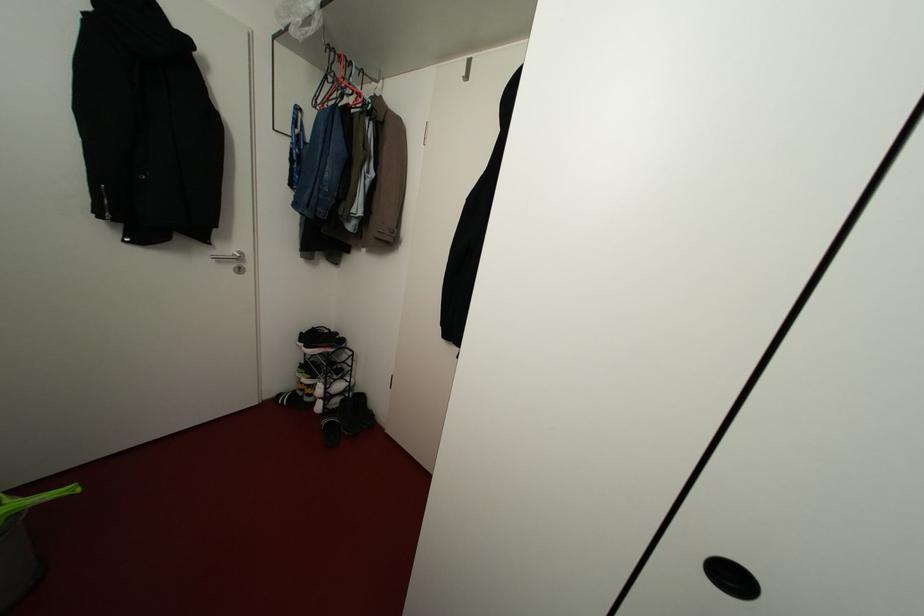
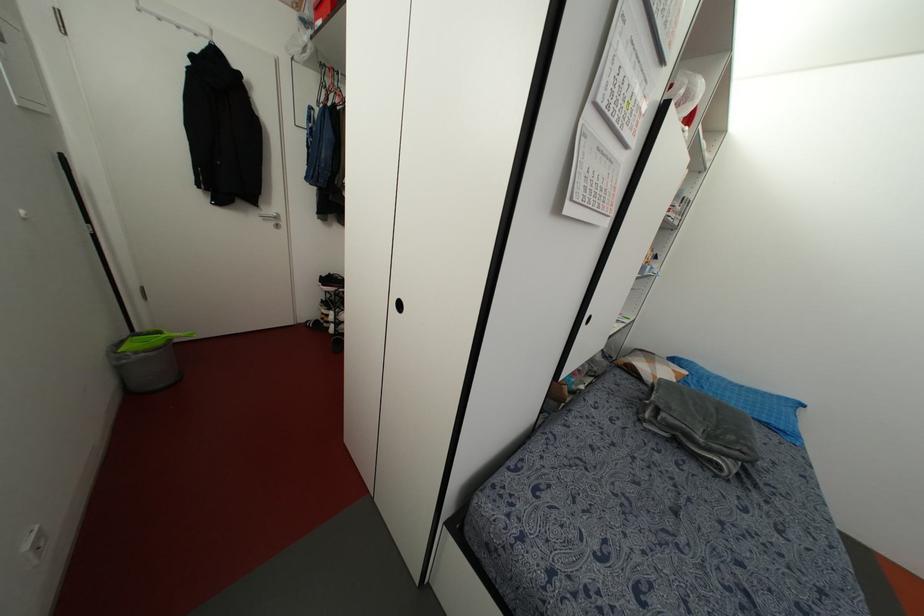
Find the pixel in the second image that matches point 730,577 in the first image.

(398, 305)